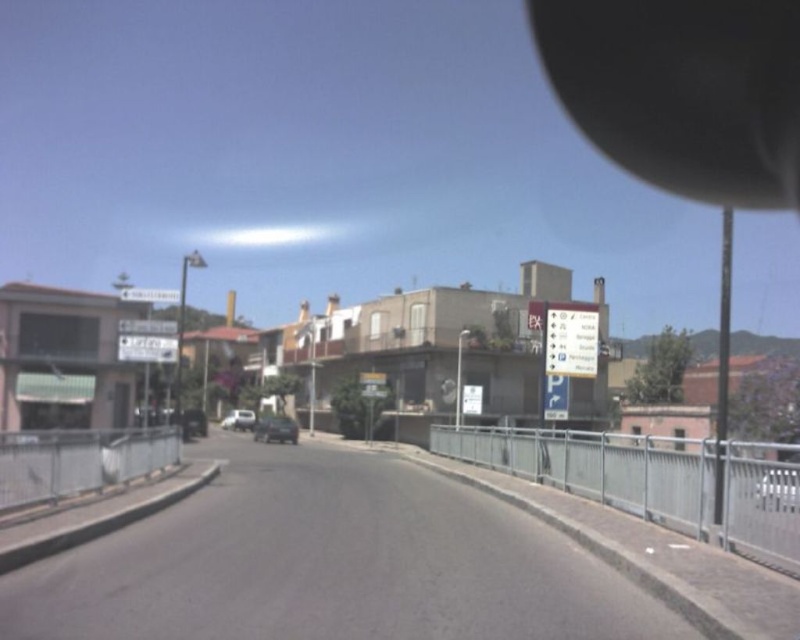
Question: Can you confirm if metallic silver car at center is bigger than silver metallic car at center?

Choices:
 (A) no
 (B) yes

Answer: (B)

Question: Does metallic silver car at center appear on the left side of silver metallic car at center?

Choices:
 (A) yes
 (B) no

Answer: (B)

Question: Is metallic silver car at center wider than silver metallic car at center?

Choices:
 (A) no
 (B) yes

Answer: (B)